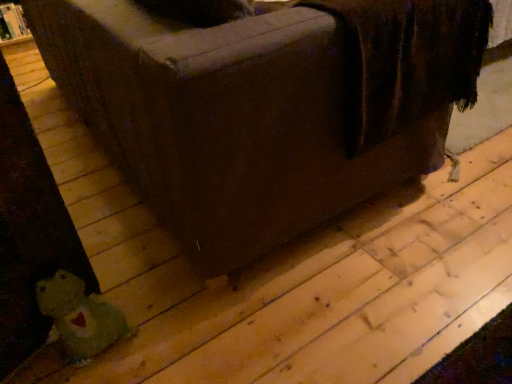
Question: Could green plush toy at lower left be considered to be inside green plush bear at lower left?

Choices:
 (A) yes
 (B) no

Answer: (B)

Question: Is green plush bear at lower left located outside green plush toy at lower left?

Choices:
 (A) yes
 (B) no

Answer: (A)

Question: Can you confirm if green plush bear at lower left is shorter than green plush toy at lower left?

Choices:
 (A) no
 (B) yes

Answer: (A)

Question: Considering the relative sizes of green plush bear at lower left and green plush toy at lower left in the image provided, is green plush bear at lower left bigger than green plush toy at lower left?

Choices:
 (A) no
 (B) yes

Answer: (B)

Question: Are green plush bear at lower left and green plush toy at lower left making contact?

Choices:
 (A) yes
 (B) no

Answer: (B)

Question: From the image's perspective, is green plush bear at lower left above green plush toy at lower left?

Choices:
 (A) yes
 (B) no

Answer: (A)

Question: Is green plush toy at lower left in contact with green plush bear at lower left?

Choices:
 (A) yes
 (B) no

Answer: (B)

Question: Is green plush toy at lower left oriented away from green plush bear at lower left?

Choices:
 (A) no
 (B) yes

Answer: (A)

Question: Could you tell me if green plush toy at lower left is facing green plush bear at lower left?

Choices:
 (A) no
 (B) yes

Answer: (A)

Question: From the image's perspective, is green plush toy at lower left beneath green plush bear at lower left?

Choices:
 (A) no
 (B) yes

Answer: (B)

Question: Can you confirm if green plush toy at lower left is wider than green plush bear at lower left?

Choices:
 (A) yes
 (B) no

Answer: (B)

Question: From a real-world perspective, is green plush toy at lower left located higher than green plush bear at lower left?

Choices:
 (A) no
 (B) yes

Answer: (A)

Question: In terms of width, does green plush toy at lower left look wider or thinner when compared to green plush bear at lower left?

Choices:
 (A) wide
 (B) thin

Answer: (B)